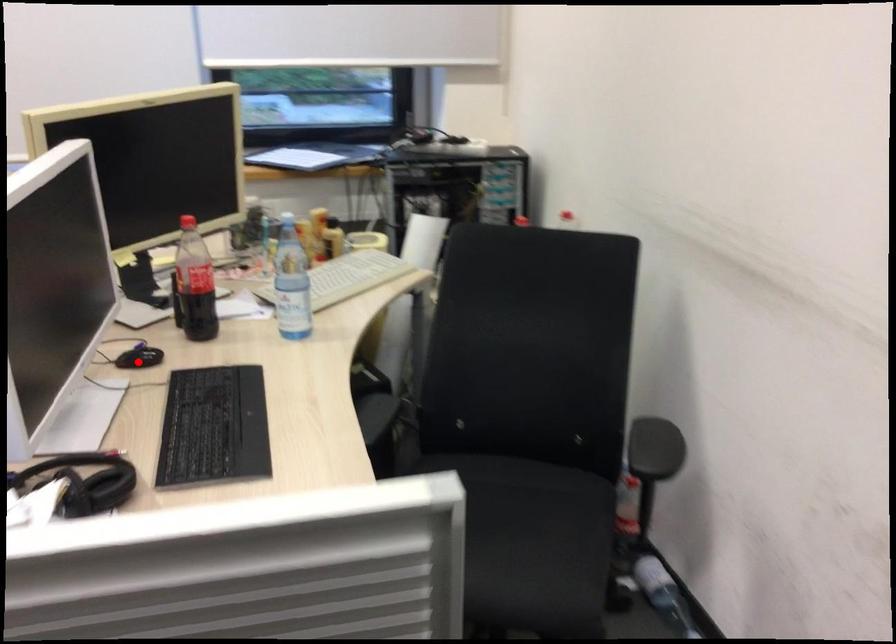
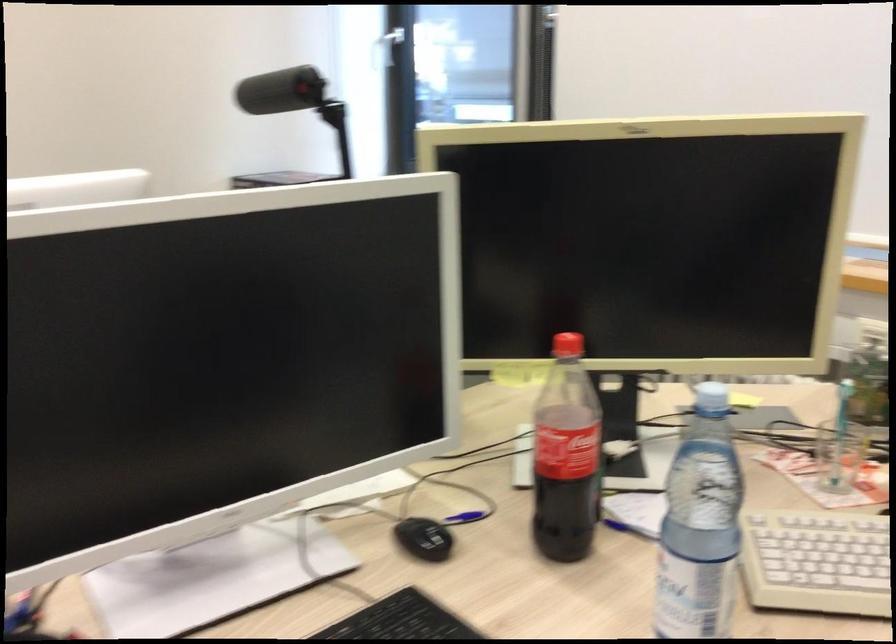
Question: I am providing you with two images of the same scene from different viewpoints. In image1, a red point is highlighted. Considering the same 3D point in image2, which of the following is correct?

Choices:
 (A) It is closer
 (B) It is farther

Answer: (A)